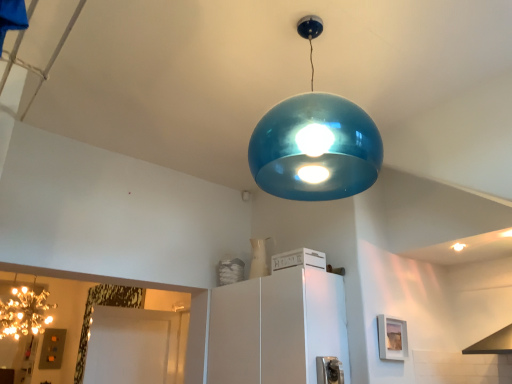
Question: Should I look upward or downward to see white matte crate at center, arranged as the 1th appliance when viewed from the back?

Choices:
 (A) up
 (B) down

Answer: (B)

Question: Considering the relative sizes of metallic silver outlet at lower center, which is counted as the first appliance, starting from the front, and white matte crate at center, arranged as the 1th appliance when viewed from the back, in the image provided, is metallic silver outlet at lower center, which is counted as the first appliance, starting from the front, smaller than white matte crate at center, arranged as the 1th appliance when viewed from the back,?

Choices:
 (A) no
 (B) yes

Answer: (B)

Question: Is metallic silver outlet at lower center, which is counted as the first appliance, starting from the front, behind white matte crate at center, positioned as the 2th appliance in bottom-to-top order?

Choices:
 (A) yes
 (B) no

Answer: (B)

Question: Does metallic silver outlet at lower center, which is the 1th appliance in bottom-to-top order, appear on the left side of white matte crate at center, marked as the 1th appliance in a top-to-bottom arrangement?

Choices:
 (A) no
 (B) yes

Answer: (A)

Question: Is metallic silver outlet at lower center, which is the 1th appliance in bottom-to-top order, turned away from white matte crate at center, acting as the 2th appliance starting from the front?

Choices:
 (A) no
 (B) yes

Answer: (A)

Question: Is metallic silver outlet at lower center, which is the 1th appliance in bottom-to-top order, to the right of white matte crate at center, positioned as the 2th appliance in bottom-to-top order, from the viewer's perspective?

Choices:
 (A) no
 (B) yes

Answer: (B)

Question: From a real-world perspective, is metallic silver outlet at lower center, which is the 1th appliance in bottom-to-top order, on top of white matte crate at center, marked as the 1th appliance in a top-to-bottom arrangement?

Choices:
 (A) no
 (B) yes

Answer: (A)

Question: Does white matte cabinet at center have a greater height compared to metallic silver outlet at lower center, the 2th appliance in the top-to-bottom sequence?

Choices:
 (A) no
 (B) yes

Answer: (B)

Question: From a real-world perspective, is white matte cabinet at center over metallic silver outlet at lower center, the 2th appliance in the top-to-bottom sequence?

Choices:
 (A) yes
 (B) no

Answer: (A)

Question: Is white matte cabinet at center not close to metallic silver outlet at lower center, which is the 1th appliance in bottom-to-top order?

Choices:
 (A) yes
 (B) no

Answer: (B)

Question: Is metallic silver outlet at lower center, the 2th appliance in the top-to-bottom sequence, a part of white matte cabinet at center?

Choices:
 (A) yes
 (B) no

Answer: (B)

Question: Considering the relative positions of white matte cabinet at center and metallic silver outlet at lower center, which is the 1th appliance in bottom-to-top order, in the image provided, is white matte cabinet at center to the right of metallic silver outlet at lower center, which is the 1th appliance in bottom-to-top order, from the viewer's perspective?

Choices:
 (A) no
 (B) yes

Answer: (A)

Question: Could you tell me if white matte cabinet at center is turned towards metallic silver outlet at lower center, which ranks as the 2th appliance in back-to-front order?

Choices:
 (A) yes
 (B) no

Answer: (B)

Question: Is glossy metallic light bulb at upper center at the left side of white matte crate at center, acting as the 2th appliance starting from the front?

Choices:
 (A) yes
 (B) no

Answer: (B)